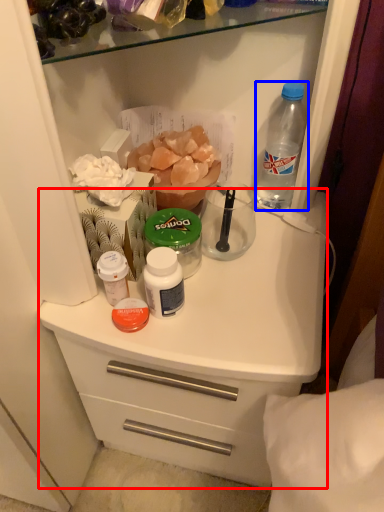
Question: Which object appears farthest to the camera in this image, counter (highlighted by a red box) or bottle (highlighted by a blue box)?

Choices:
 (A) counter
 (B) bottle

Answer: (B)